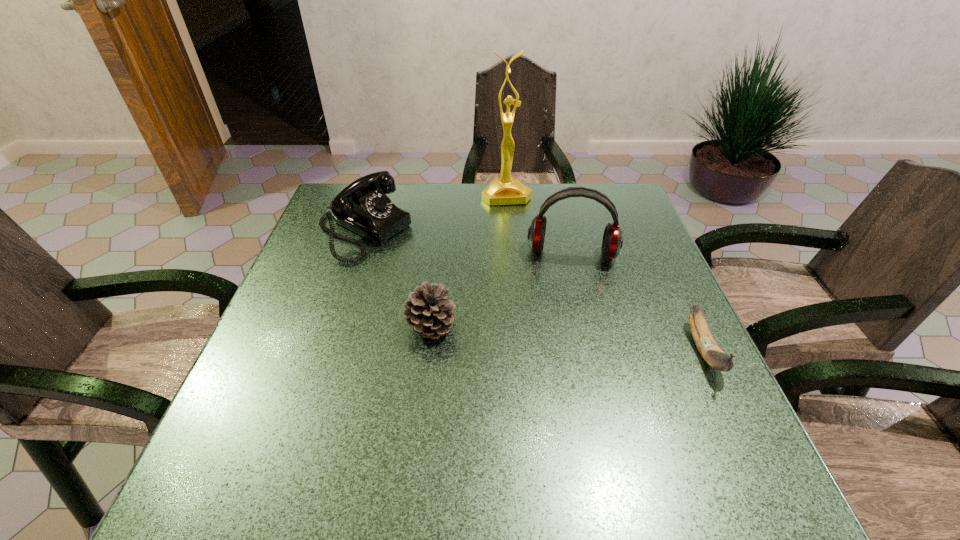
Locate an element on the screen. free spot on the desktop that is between the pinecone and the rightmost object and is positioned on the ear cups of the earphone is located at coordinates (566, 339).

What are the coordinates of `free space on the desktop that is between the pinecone and the rightmost object and is positioned on the front-facing side of the tallest object` in the screenshot? It's located at (552, 337).

The width and height of the screenshot is (960, 540). What are the coordinates of `free spot on the desktop that is between the fourth tallest object and the rightmost object and is positioned on the dial of the third tallest object` in the screenshot? It's located at (569, 339).